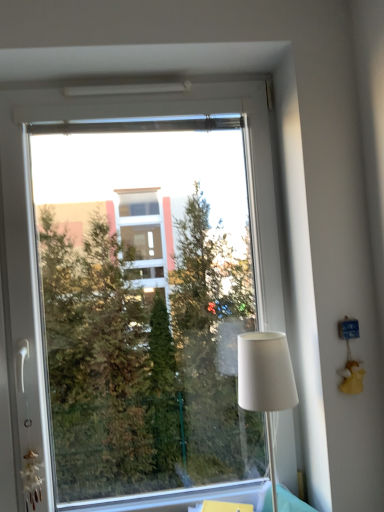
Question: Is white fabric lampshade at right next to transparent glass window at center and touching it?

Choices:
 (A) no
 (B) yes

Answer: (A)

Question: Is white fabric lampshade at right not close to transparent glass window at center?

Choices:
 (A) yes
 (B) no

Answer: (A)

Question: Considering the relative sizes of white fabric lampshade at right and transparent glass window at center in the image provided, is white fabric lampshade at right smaller than transparent glass window at center?

Choices:
 (A) yes
 (B) no

Answer: (A)

Question: Does white fabric lampshade at right come in front of transparent glass window at center?

Choices:
 (A) no
 (B) yes

Answer: (B)

Question: From a real-world perspective, is white fabric lampshade at right on transparent glass window at center?

Choices:
 (A) no
 (B) yes

Answer: (A)

Question: Considering the relative positions of white fabric lampshade at right and transparent glass window at center in the image provided, is white fabric lampshade at right to the left of transparent glass window at center from the viewer's perspective?

Choices:
 (A) no
 (B) yes

Answer: (A)

Question: Can you confirm if transparent glass window at center is thinner than white fabric lampshade at right?

Choices:
 (A) yes
 (B) no

Answer: (A)

Question: Is transparent glass window at center taller than white fabric lampshade at right?

Choices:
 (A) no
 (B) yes

Answer: (B)

Question: Is transparent glass window at center smaller than white fabric lampshade at right?

Choices:
 (A) no
 (B) yes

Answer: (A)

Question: Is transparent glass window at center beside white fabric lampshade at right?

Choices:
 (A) yes
 (B) no

Answer: (B)

Question: Does transparent glass window at center appear on the right side of white fabric lampshade at right?

Choices:
 (A) no
 (B) yes

Answer: (A)

Question: From the image's perspective, is transparent glass window at center under white fabric lampshade at right?

Choices:
 (A) no
 (B) yes

Answer: (A)

Question: Based on their positions, is white fabric lampshade at right located to the left or right of transparent glass window at center?

Choices:
 (A) right
 (B) left

Answer: (A)